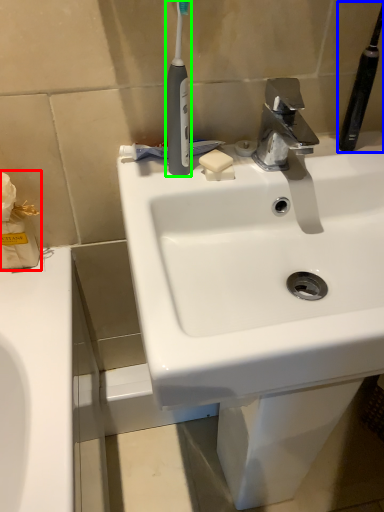
Question: Which is nearer to the tissue (highlighted by a red box)? toothbrush (highlighted by a blue box) or toothbrush (highlighted by a green box).

Choices:
 (A) toothbrush
 (B) toothbrush

Answer: (B)